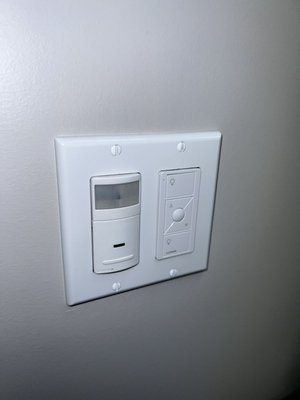
The image size is (300, 400). What are the coordinates of `the bottom right screw` in the screenshot? It's located at (x=173, y=273).